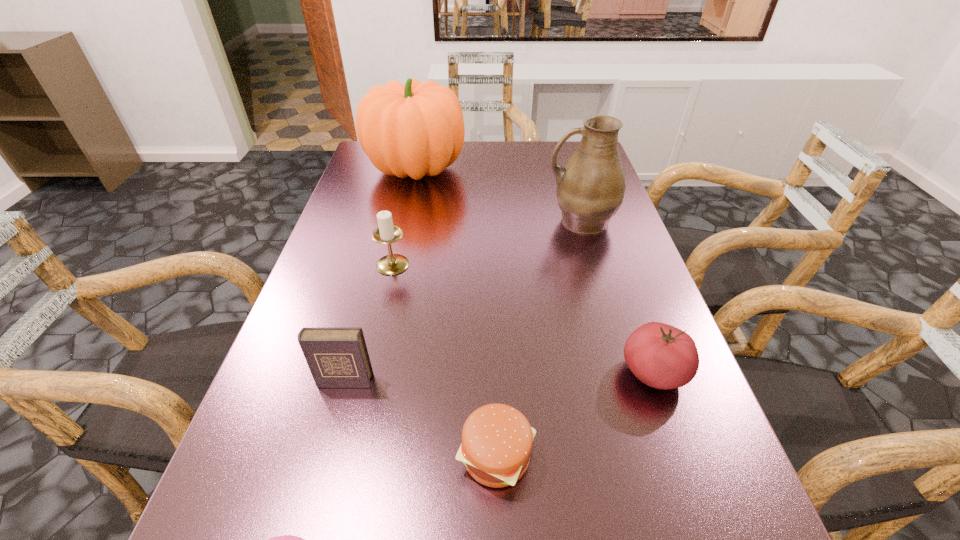
Find the location of a particular element. pumpkin is located at coordinates (416, 129).

The image size is (960, 540). Find the location of `pitcher`. pitcher is located at coordinates (590, 189).

At what (x,y) coordinates should I click in order to perform the action: click on the third farthest object. Please return your answer as a coordinate pair (x, y). The width and height of the screenshot is (960, 540). Looking at the image, I should click on (391, 264).

Where is `diary`? The width and height of the screenshot is (960, 540). diary is located at coordinates (337, 357).

Locate an element on the screen. tomato is located at coordinates (661, 356).

The image size is (960, 540). Find the location of `hamburger`. hamburger is located at coordinates (497, 439).

At what (x,y) coordinates should I click in order to perform the action: click on the second nearest object. Please return your answer as a coordinate pair (x, y). The height and width of the screenshot is (540, 960). Looking at the image, I should click on (497, 439).

This screenshot has height=540, width=960. Identify the location of free space located 0.120m on the right of the farthest object. (506, 169).

Where is `vacant region located 0.130m on the handle side of the second farthest object`? Image resolution: width=960 pixels, height=540 pixels. vacant region located 0.130m on the handle side of the second farthest object is located at coordinates (493, 221).

At what (x,y) coordinates should I click in order to perform the action: click on free spot located on the handle side of the second farthest object. Please return your answer as a coordinate pair (x, y). The height and width of the screenshot is (540, 960). Looking at the image, I should click on (396, 221).